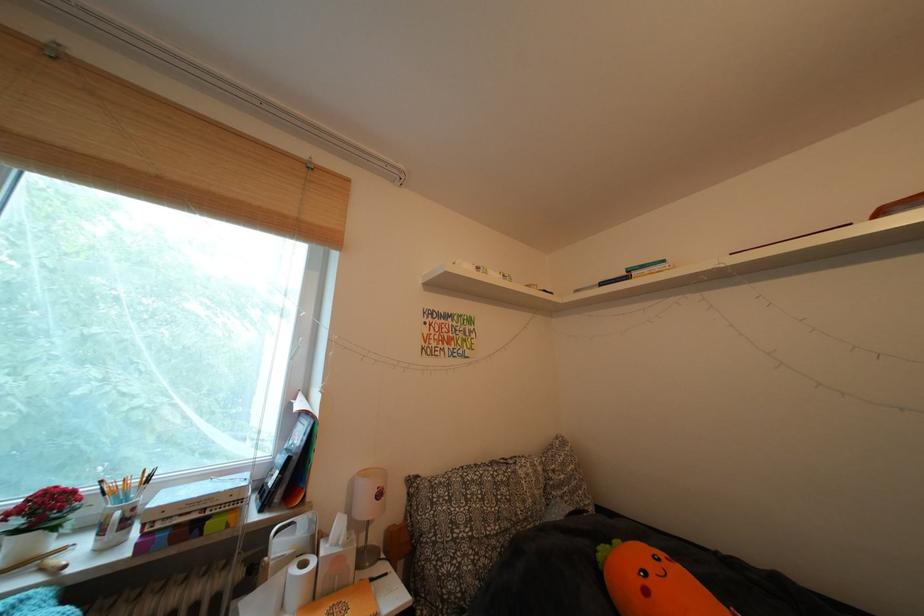
Locate an element on the screen. The width and height of the screenshot is (924, 616). blind pull cord is located at coordinates (310, 163).